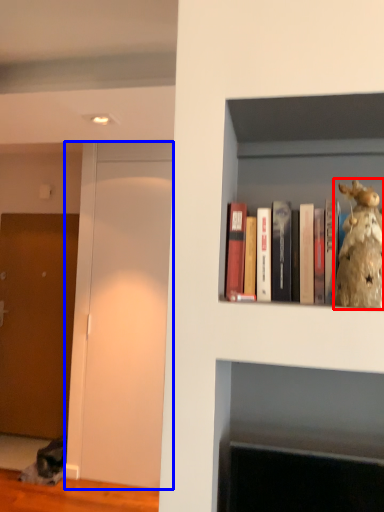
Question: Which of the following is the farthest to the observer, figurine (highlighted by a red box) or glass door (highlighted by a blue box)?

Choices:
 (A) figurine
 (B) glass door

Answer: (B)